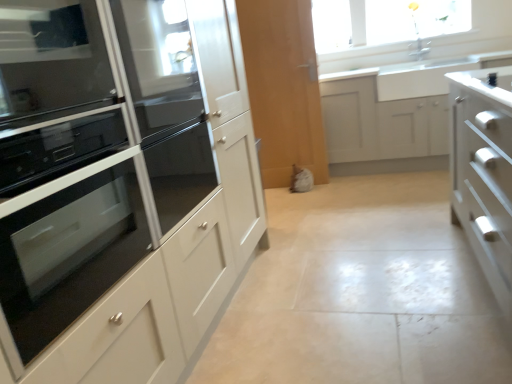
Question: Is black glass oven at left far away from white ceramic sink at upper right?

Choices:
 (A) yes
 (B) no

Answer: (A)

Question: Does black glass oven at left have a lesser height compared to white ceramic sink at upper right?

Choices:
 (A) yes
 (B) no

Answer: (B)

Question: Does black glass oven at left have a larger size compared to white ceramic sink at upper right?

Choices:
 (A) no
 (B) yes

Answer: (A)

Question: Is black glass oven at left smaller than white ceramic sink at upper right?

Choices:
 (A) no
 (B) yes

Answer: (B)

Question: Does black glass oven at left appear on the left side of white ceramic sink at upper right?

Choices:
 (A) no
 (B) yes

Answer: (B)

Question: Can white ceramic sink at upper right be found inside black glass oven at left?

Choices:
 (A) yes
 (B) no

Answer: (B)

Question: Is the depth of black glass oven at left less than that of black glass oven at left?

Choices:
 (A) yes
 (B) no

Answer: (A)

Question: Considering the relative sizes of black glass oven at left and black glass oven at left in the image provided, is black glass oven at left thinner than black glass oven at left?

Choices:
 (A) yes
 (B) no

Answer: (B)

Question: Could black glass oven at left be considered to be inside black glass oven at left?

Choices:
 (A) yes
 (B) no

Answer: (B)

Question: Is black glass oven at left oriented towards black glass oven at left?

Choices:
 (A) no
 (B) yes

Answer: (A)

Question: Are black glass oven at left and black glass oven at left beside each other?

Choices:
 (A) no
 (B) yes

Answer: (A)

Question: Can you confirm if black glass oven at left is shorter than black glass oven at left?

Choices:
 (A) yes
 (B) no

Answer: (B)

Question: Can you confirm if white ceramic sink at upper right is positioned to the right of matte white oven at left, the 1th cabinetry from the left?

Choices:
 (A) yes
 (B) no

Answer: (A)